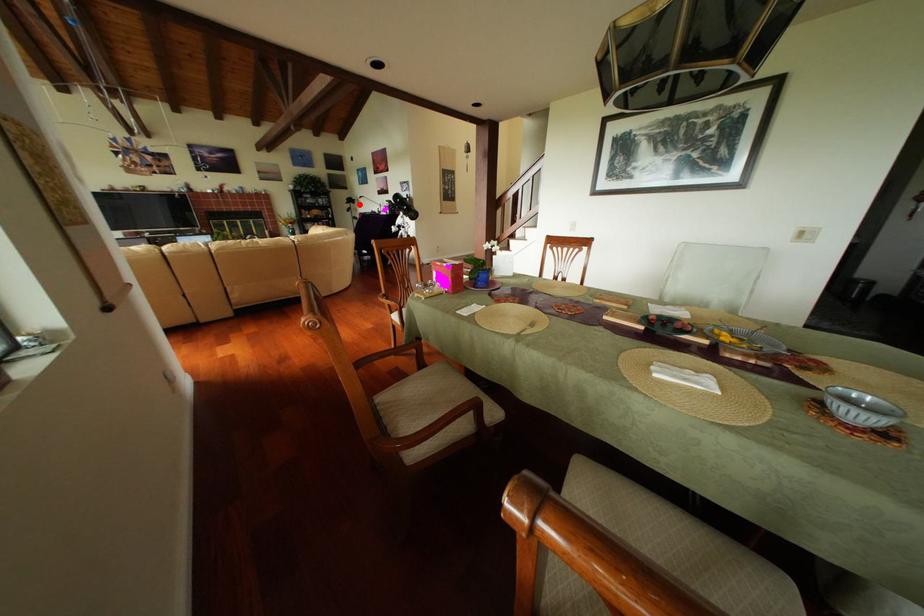
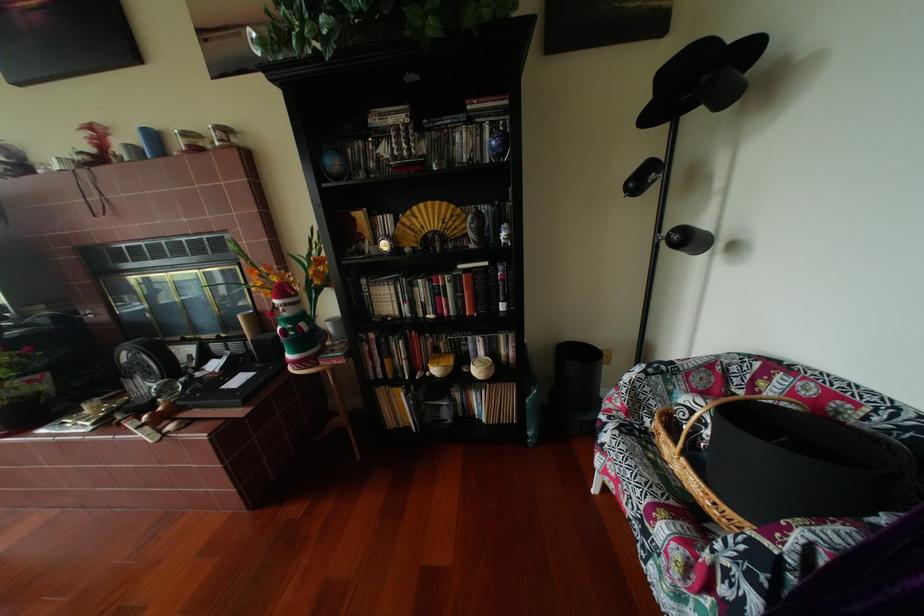
Question: I am providing you with two images of the same scene from different viewpoints. A red point is shown in image1. For the corresponding object point in image2, is it positioned nearer or farther from the camera?

Choices:
 (A) Nearer
 (B) Farther

Answer: (B)